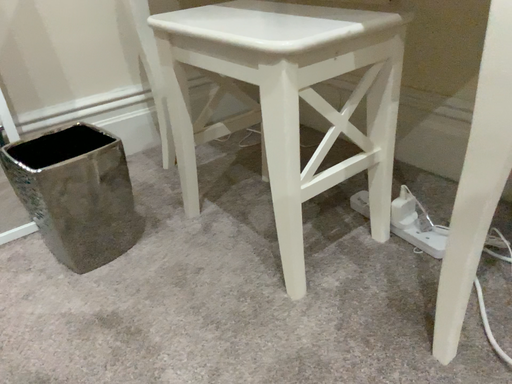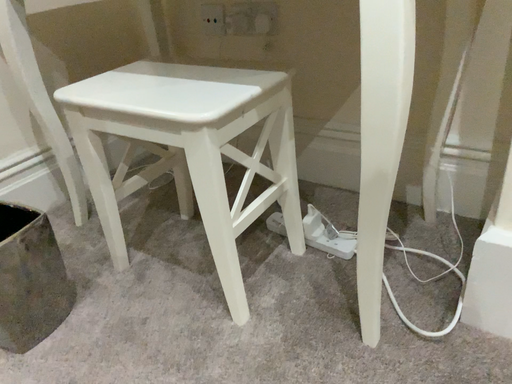
Question: How did the camera likely rotate when shooting the video?

Choices:
 (A) rotated right
 (B) rotated left

Answer: (A)